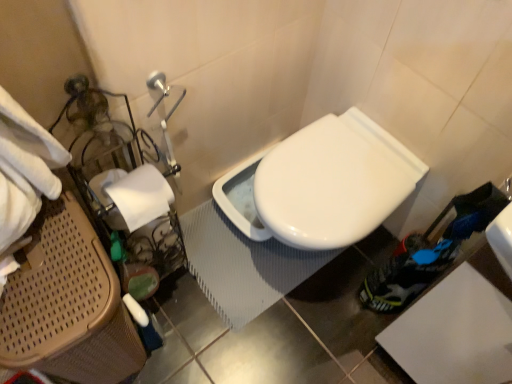
Question: From the image's perspective, is white matte toilet paper at left located above or below white glossy toilet at center?

Choices:
 (A) below
 (B) above

Answer: (B)

Question: Considering the relative positions of white matte toilet paper at left and white glossy toilet at center in the image provided, is white matte toilet paper at left to the left or to the right of white glossy toilet at center?

Choices:
 (A) left
 (B) right

Answer: (A)

Question: Estimate the real-world distances between objects in this image. Which object is closer to the brown woven laundry basket at left?

Choices:
 (A) white glossy toilet at center
 (B) white matte toilet paper at left

Answer: (B)

Question: Which object is the farthest from the white matte toilet paper at left?

Choices:
 (A) brown woven laundry basket at left
 (B) white glossy toilet at center

Answer: (B)